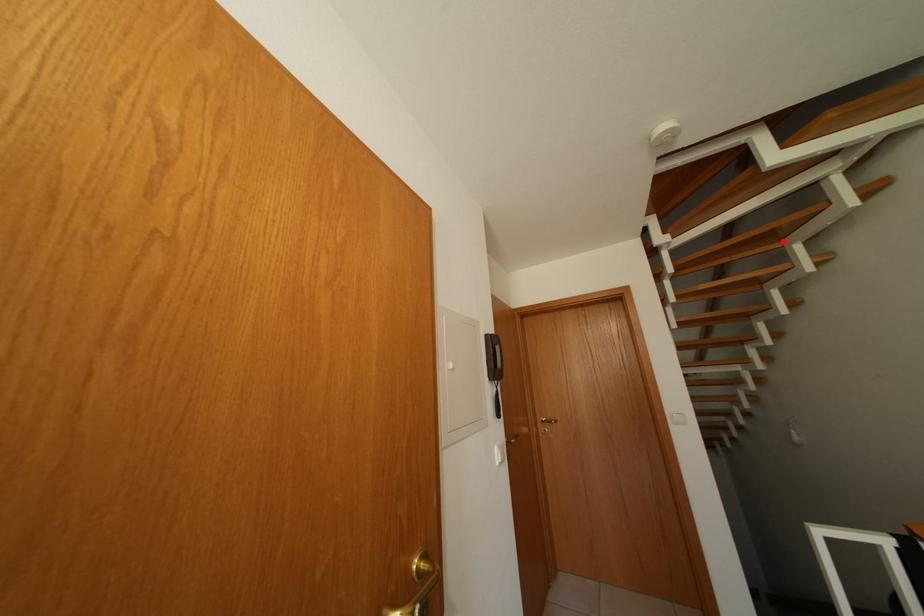
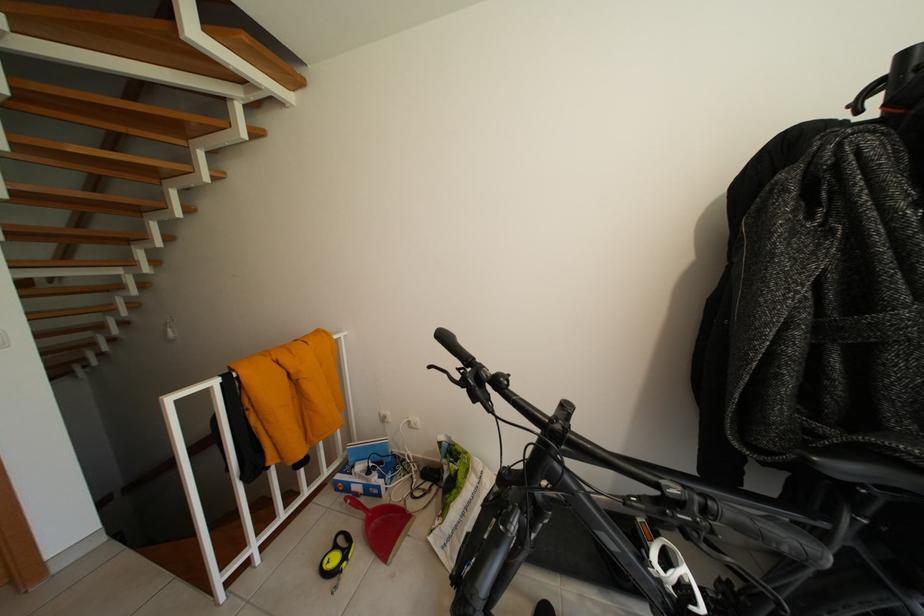
The point at the highlighted location is marked in the first image. Where is the corresponding point in the second image?

(190, 137)